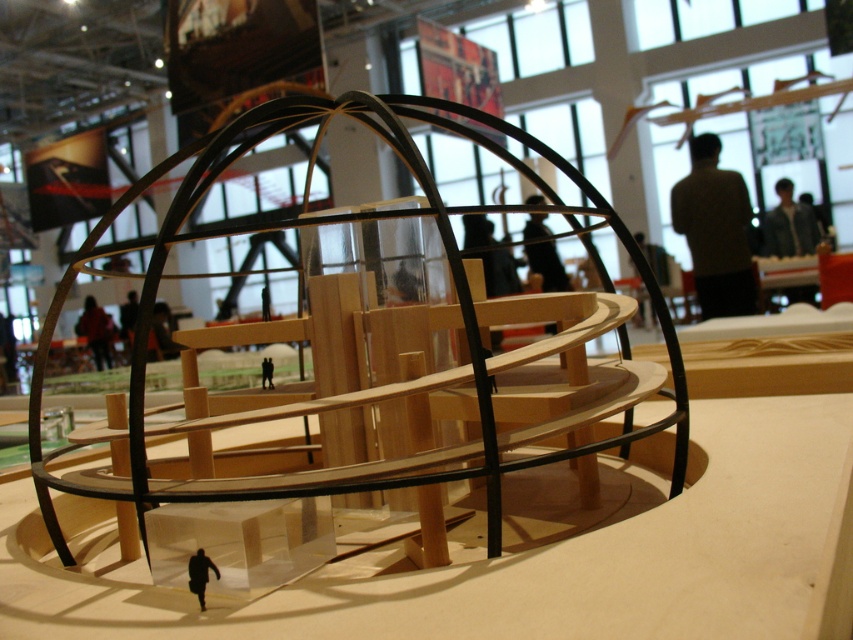
You are a person who is 1.7 meters tall and want to reach the dark brown leather jacket at center from the light brown sweater at upper right. Can you do so without bending down or jumping?

The distance between the light brown sweater at upper right and dark brown leather jacket at center is 1.84 meters. Since you are 1.7 meters tall, you can easily walk the distance without needing to bend down or jump.

You are an attendee at the exhibition and want to see both the light brown sweater at upper right and the dark brown leather jacket at center. Which one is located higher in the image?

The light brown sweater at upper right is positioned over the dark brown leather jacket at center, so it is higher in the image.